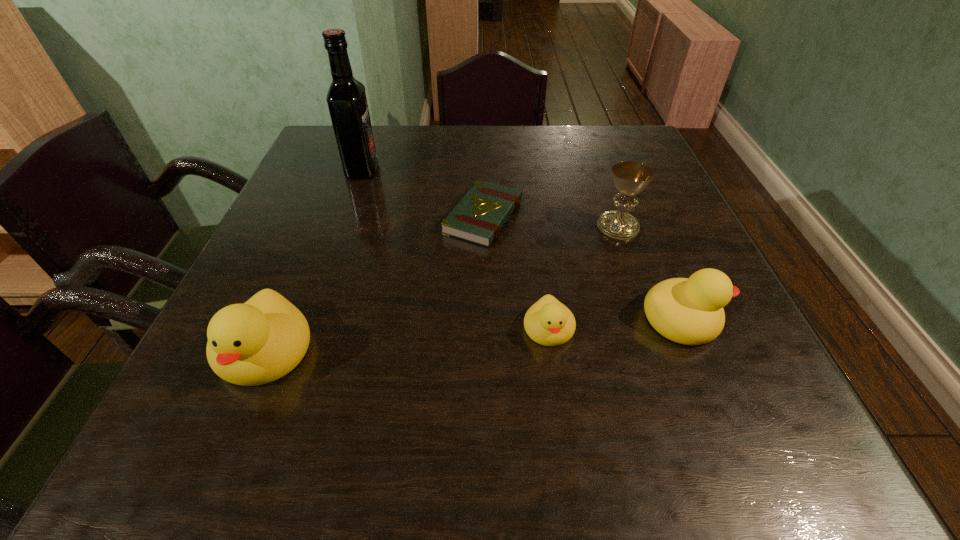
In order to click on vacant space that satisfies the following two spatial constraints: 1. on the front-facing side of the tallest object; 2. on the face of the leftmost duckling in this screenshot , I will do `click(298, 352)`.

You are a GUI agent. You are given a task and a screenshot of the screen. Output one action in this format:
    pyautogui.click(x=<x>, y=<y>)
    Task: Click on the vacant point that satisfies the following two spatial constraints: 1. on the front-facing side of the liquor; 2. on the face of the leftmost duckling
    The width and height of the screenshot is (960, 540).
    Given the screenshot: What is the action you would take?
    tap(298, 352)